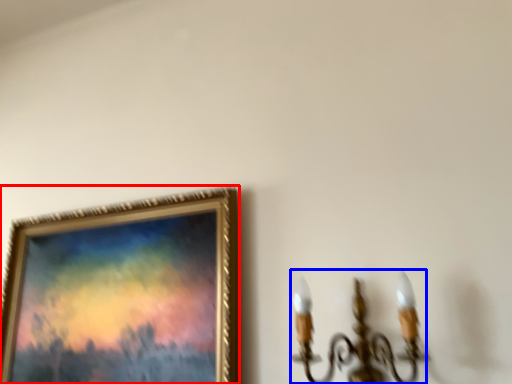
Question: Among these objects, which one is nearest to the camera, picture frame (highlighted by a red box) or lamp (highlighted by a blue box)?

Choices:
 (A) picture frame
 (B) lamp

Answer: (B)